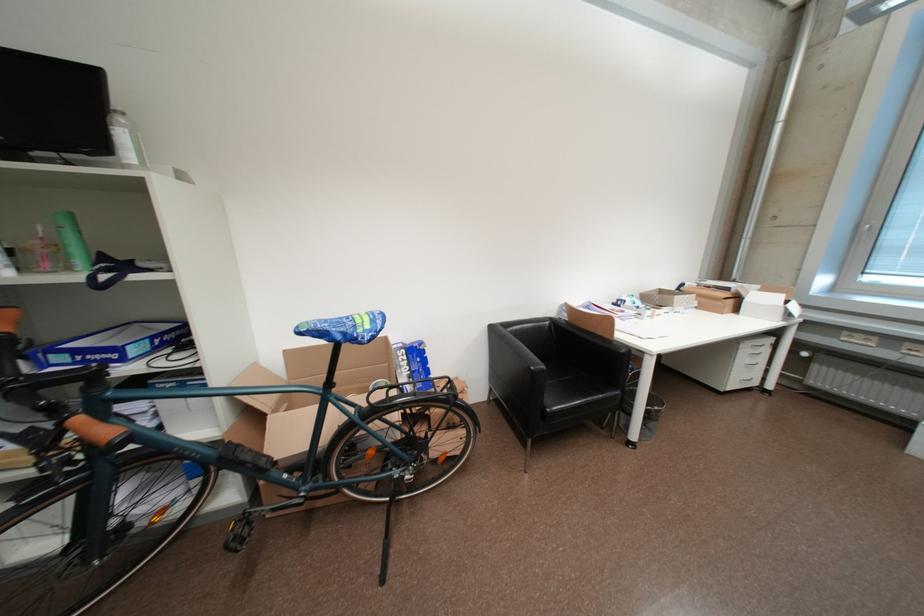
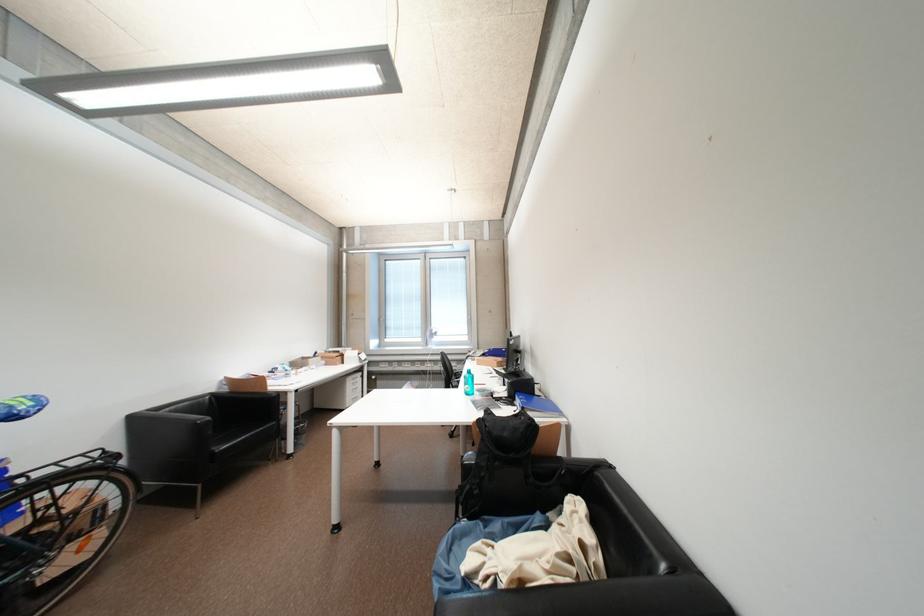
The point at (608, 334) is marked in the first image. Where is the corresponding point in the second image?

(264, 392)